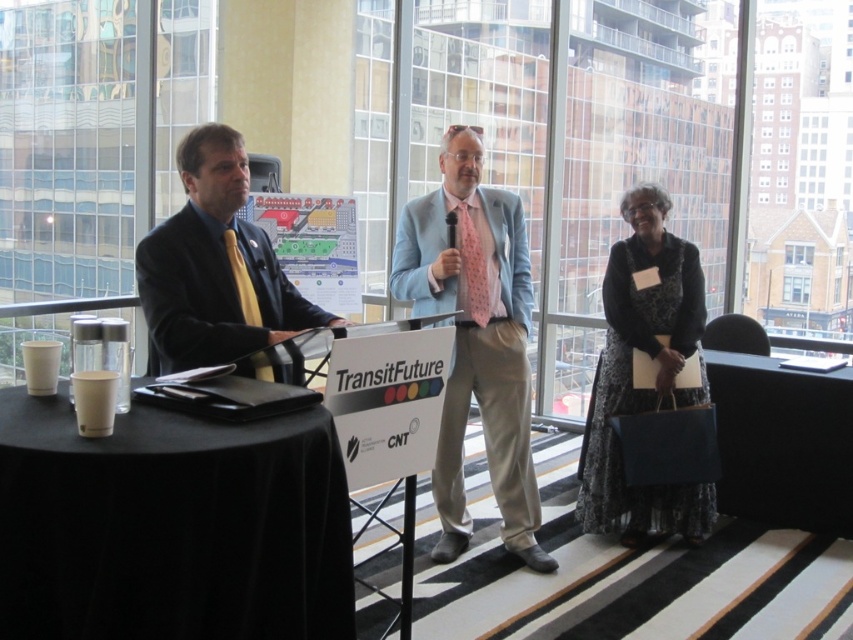
You are attending a conference and need to take a photo of the light blue fabric suit at center without getting too close. The camera you have can focus clearly up to 3 meters. Can you take a clear photo from your current position?

The light blue fabric suit at center and the camera are 3.44 meters apart. Since the camera can focus up to 3 meters, the distance is too far to take a clear photo without moving closer.